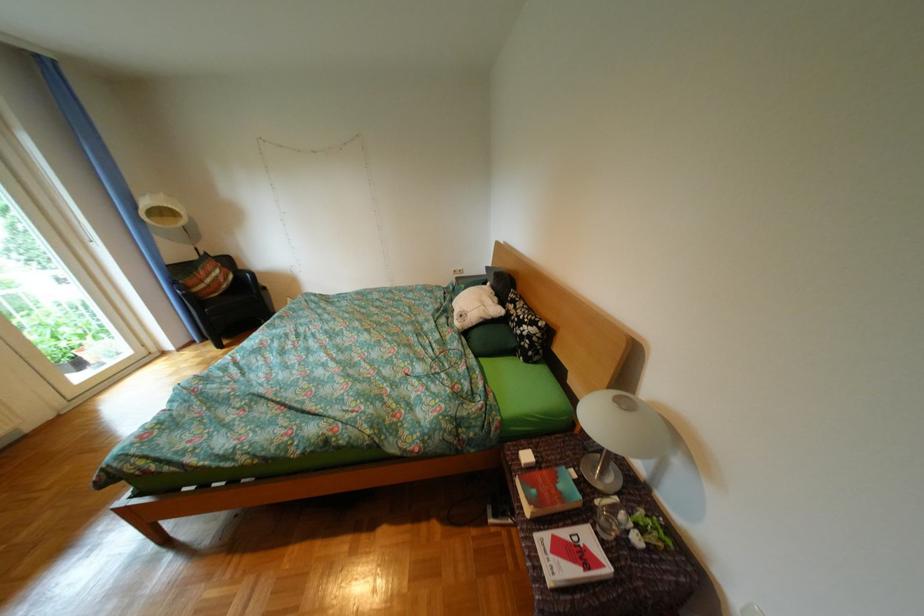
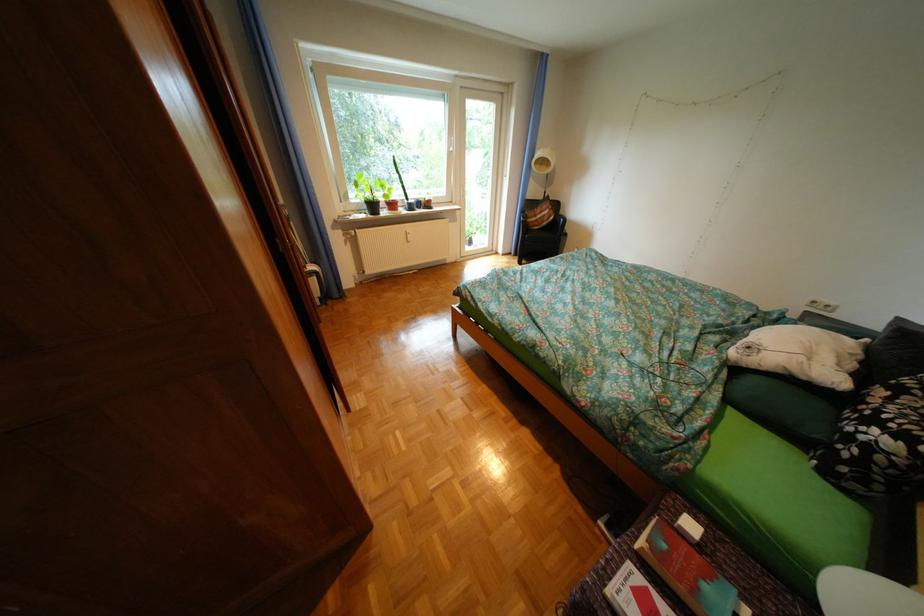
In the second image, find the point that corresponds to [246,304] in the first image.

(555, 238)